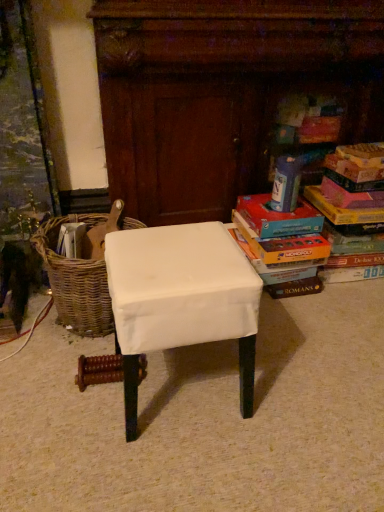
The image size is (384, 512). Identify the location of vacant space situated above white fabric-covered stool at center (from a real-world perspective). (176, 252).